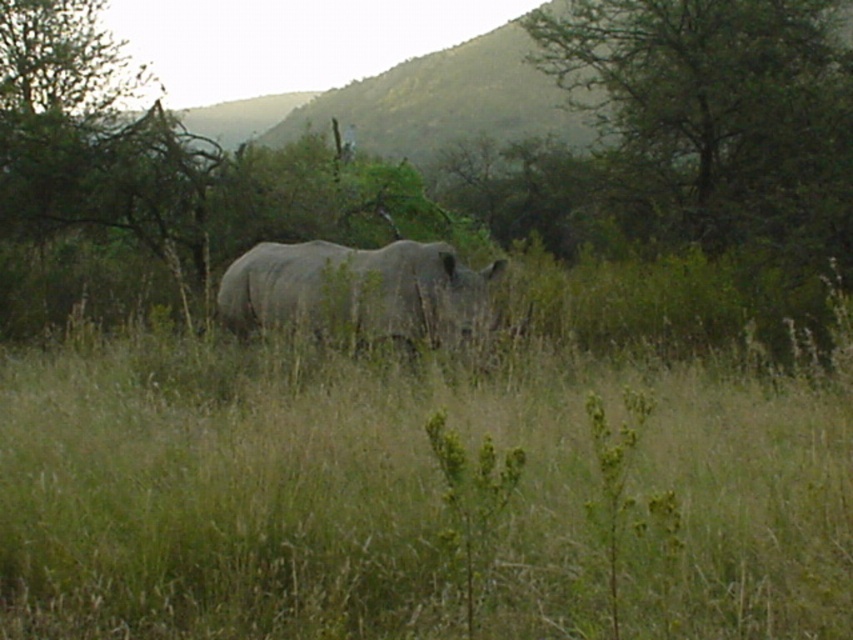
Question: Which of the following is the closest to the observer?

Choices:
 (A) (332, 259)
 (B) (628, 35)

Answer: (A)

Question: Which object appears closest to the camera in this image?

Choices:
 (A) green leafy tree at upper right
 (B) gray matte rhinoceros at center

Answer: (B)

Question: Is green leafy tree at upper right above gray matte rhinoceros at center?

Choices:
 (A) yes
 (B) no

Answer: (A)

Question: Can you confirm if green leafy tree at upper right is positioned to the left of gray matte rhinoceros at center?

Choices:
 (A) yes
 (B) no

Answer: (B)

Question: Is green leafy tree at upper right positioned at the back of gray matte rhinoceros at center?

Choices:
 (A) yes
 (B) no

Answer: (A)

Question: Among these points, which one is farthest from the camera?

Choices:
 (A) (393, 317)
 (B) (614, 96)

Answer: (B)